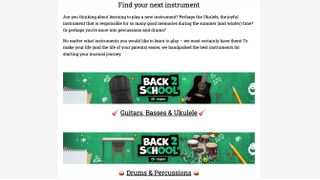
Identify the location of desk. The width and height of the screenshot is (320, 180). (116, 145).